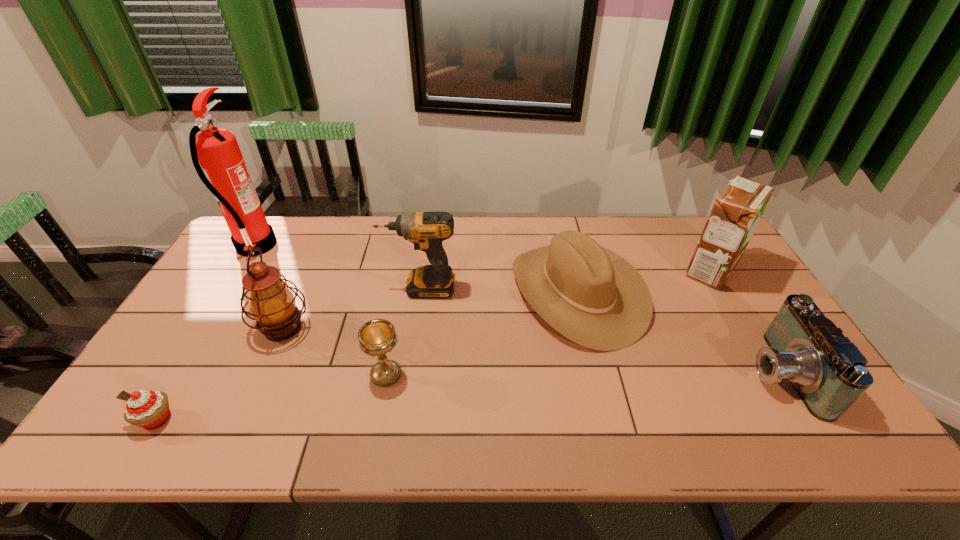
Locate an element on the screen. This screenshot has width=960, height=540. camcorder located at the right edge is located at coordinates (828, 372).

In order to click on object at the far left corner in this screenshot , I will do `click(224, 172)`.

At what (x,y) coordinates should I click in order to perform the action: click on object located in the near left corner section of the desktop. Please return your answer as a coordinate pair (x, y). Looking at the image, I should click on (148, 409).

Locate an element on the screen. object that is at the far right corner is located at coordinates (737, 210).

You are a GUI agent. You are given a task and a screenshot of the screen. Output one action in this format:
    pyautogui.click(x=<x>, y=<y>)
    Task: Click on the object that is at the near right corner
    
    Given the screenshot: What is the action you would take?
    pyautogui.click(x=828, y=372)

In the image, there is a desktop. Where is `vacant space at the far edge`? The height and width of the screenshot is (540, 960). vacant space at the far edge is located at coordinates (466, 237).

Locate an element on the screen. vacant space at the near edge is located at coordinates (765, 411).

Identify the location of vacant space at the left edge. (224, 336).

Locate an element on the screen. This screenshot has height=540, width=960. vacant area at the right edge of the desktop is located at coordinates (764, 315).

Locate an element on the screen. free region at the far left corner of the desktop is located at coordinates (275, 227).